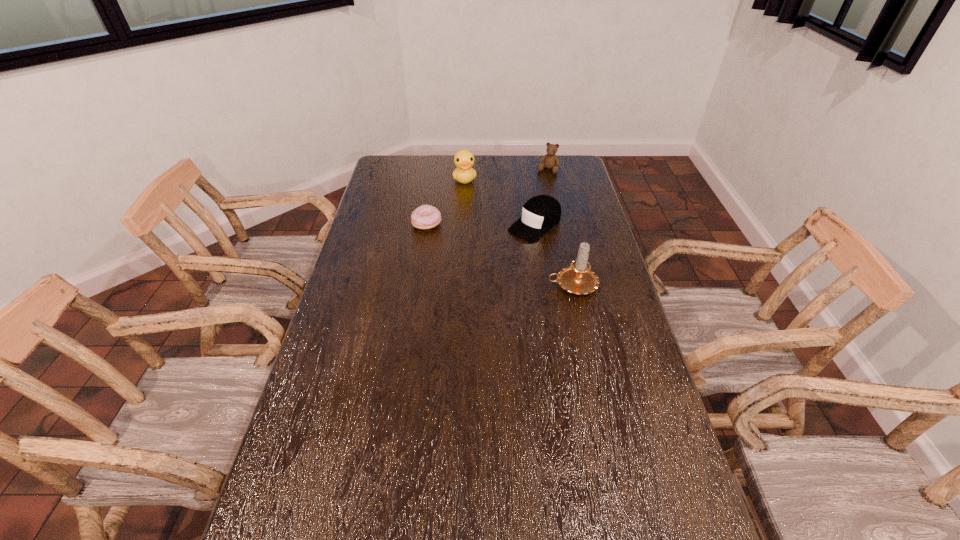
What are the coordinates of `vacant region located on the front-facing side of the third tallest object` in the screenshot? It's located at (536, 191).

Locate an element on the screen. vacant region located 0.250m on the front-facing side of the third tallest object is located at coordinates (529, 203).

Where is `vacant position located on the front-facing side of the third tallest object`? The width and height of the screenshot is (960, 540). vacant position located on the front-facing side of the third tallest object is located at coordinates 541,181.

Identify the location of blank space located on the face of the fourth object from right to left. Image resolution: width=960 pixels, height=540 pixels. (468, 206).

You are a GUI agent. You are given a task and a screenshot of the screen. Output one action in this format:
    pyautogui.click(x=<x>, y=<y>)
    Task: Click on the vacant position located on the face of the fourth object from right to left
    Image resolution: width=960 pixels, height=540 pixels.
    Given the screenshot: What is the action you would take?
    [x=469, y=212]

Find the location of `free space located on the face of the fourth object from right to left`. free space located on the face of the fourth object from right to left is located at coordinates (470, 215).

You are a GUI agent. You are given a task and a screenshot of the screen. Output one action in this format:
    pyautogui.click(x=<x>, y=<y>)
    Task: Click on the blank area located on the front-facing side of the second shortest object
    
    Given the screenshot: What is the action you would take?
    (468, 277)

Locate an element on the screen. free region located 0.090m on the front-facing side of the second shortest object is located at coordinates click(503, 251).

Where is `free space located on the front-facing side of the second shortest object`? The width and height of the screenshot is (960, 540). free space located on the front-facing side of the second shortest object is located at coordinates click(x=465, y=280).

Where is `teddy bear that is at the far edge`? This screenshot has width=960, height=540. teddy bear that is at the far edge is located at coordinates (551, 161).